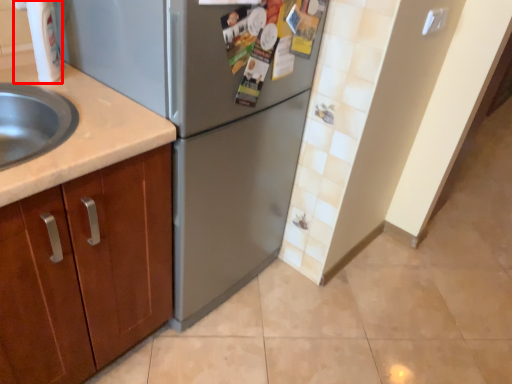
Question: From the image, what is the correct spatial relationship of faucet (annotated by the red box) in relation to refrigerator?

Choices:
 (A) left
 (B) right

Answer: (A)